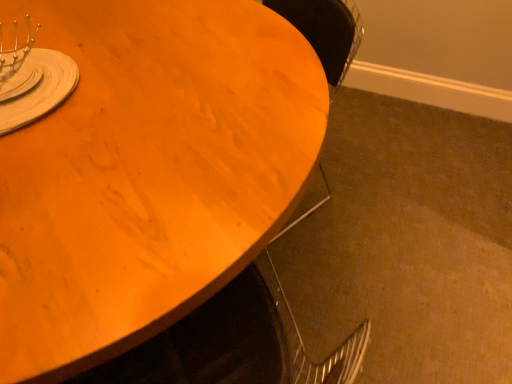
Measure the distance between point (32,89) and camera.

Point (32,89) is 37.76 inches away from camera.

What is the approximate height of matte silver fork at upper left?

It is 4.54 inches.

Locate an element on the screen. This screenshot has width=512, height=384. matte silver fork at upper left is located at coordinates (41, 90).

What do you see at coordinates (41, 90) in the screenshot? This screenshot has width=512, height=384. I see `matte silver fork at upper left` at bounding box center [41, 90].

Measure the distance between point [113,211] and camera.

A distance of 27.91 inches exists between point [113,211] and camera.

The image size is (512, 384). What do you see at coordinates (148, 172) in the screenshot?
I see `wooden table at upper left` at bounding box center [148, 172].

Find the location of `wooden table at upper left`. wooden table at upper left is located at coordinates (148, 172).

Identify the location of matte silver fork at upper left. The width and height of the screenshot is (512, 384). (41, 90).

In the image, is wooden table at upper left on the left side or the right side of matte silver fork at upper left?

wooden table at upper left is to the right of matte silver fork at upper left.

Between wooden table at upper left and matte silver fork at upper left, which one is positioned in front?

wooden table at upper left is closer to the camera.

Is point (21, 323) closer to camera compared to point (31, 63)?

Yes.

From the image's perspective, is wooden table at upper left located beneath matte silver fork at upper left?

Yes, from the image's perspective, wooden table at upper left is beneath matte silver fork at upper left.

From a real-world perspective, relative to matte silver fork at upper left, is wooden table at upper left vertically above or below?

wooden table at upper left is below matte silver fork at upper left.

Considering the sizes of wooden table at upper left and matte silver fork at upper left in the image, is wooden table at upper left wider or thinner than matte silver fork at upper left?

Considering their sizes, wooden table at upper left looks broader than matte silver fork at upper left.

Considering the relative sizes of wooden table at upper left and matte silver fork at upper left in the image provided, is wooden table at upper left shorter than matte silver fork at upper left?

No, wooden table at upper left is not shorter than matte silver fork at upper left.

Who is bigger, wooden table at upper left or matte silver fork at upper left?

wooden table at upper left is bigger.

Do you think wooden table at upper left is within matte silver fork at upper left, or outside of it?

wooden table at upper left lies outside matte silver fork at upper left.

Is wooden table at upper left far from matte silver fork at upper left?

No, there isn't a large distance between wooden table at upper left and matte silver fork at upper left.

Could you tell me if wooden table at upper left is facing matte silver fork at upper left?

No.

How different are the orientations of wooden table at upper left and matte silver fork at upper left in degrees?

The facing directions of wooden table at upper left and matte silver fork at upper left are 90.5 degrees apart.

Identify the location of table on the right of matte silver fork at upper left. The width and height of the screenshot is (512, 384). (148, 172).

Is matte silver fork at upper left to the right of wooden table at upper left from the viewer's perspective?

In fact, matte silver fork at upper left is to the left of wooden table at upper left.

In the image, is matte silver fork at upper left positioned in front of or behind wooden table at upper left?

Clearly, matte silver fork at upper left is behind wooden table at upper left.

Is point (31, 113) closer to camera compared to point (23, 380)?

No, (31, 113) is further to viewer.

Looking at this image, from the image's perspective, which object appears higher, matte silver fork at upper left or wooden table at upper left?

matte silver fork at upper left appears higher in the image.

Based on the photo, from a real-world perspective, between matte silver fork at upper left and wooden table at upper left, who is vertically higher?

matte silver fork at upper left, from a real-world perspective.

Between matte silver fork at upper left and wooden table at upper left, which one has smaller width?

Thinner between the two is matte silver fork at upper left.

Considering the sizes of objects matte silver fork at upper left and wooden table at upper left in the image provided, who is taller, matte silver fork at upper left or wooden table at upper left?

wooden table at upper left.

Does matte silver fork at upper left have a smaller size compared to wooden table at upper left?

Yes.

Would you say matte silver fork at upper left is inside or outside wooden table at upper left?

matte silver fork at upper left is not enclosed by wooden table at upper left.

Is matte silver fork at upper left far away from wooden table at upper left?

Actually, matte silver fork at upper left and wooden table at upper left are a little close together.

Could you tell me if matte silver fork at upper left is turned towards wooden table at upper left?

No, matte silver fork at upper left does not turn towards wooden table at upper left.

Identify the location of table below the matte silver fork at upper left (from the image's perspective). (148, 172).

The width and height of the screenshot is (512, 384). I want to click on table that is under the matte silver fork at upper left (from a real-world perspective), so click(148, 172).

In the image, there is a wooden table at upper left. In order to click on tableware above it (from the image's perspective) in this screenshot , I will do `click(41, 90)`.